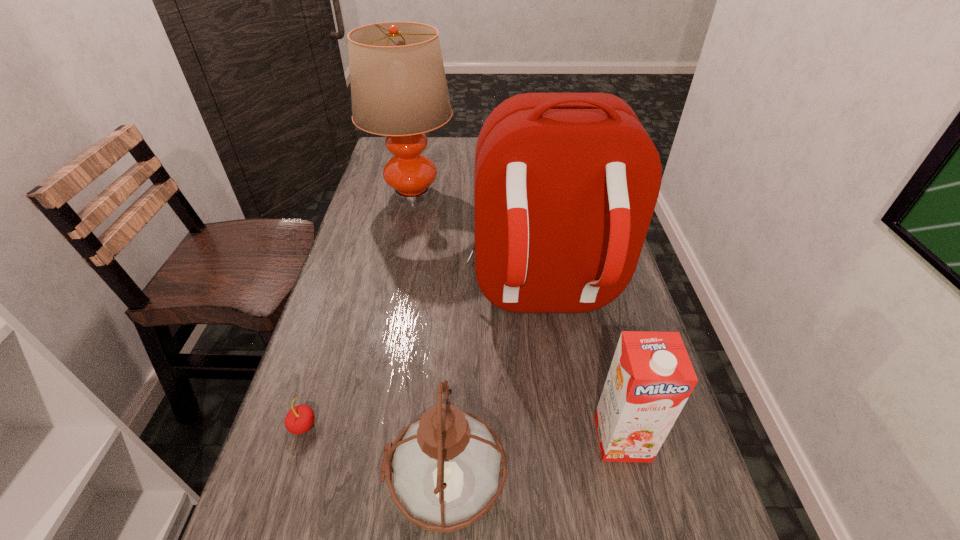
I want to click on backpack that is at the right edge, so click(x=566, y=184).

The image size is (960, 540). What are the coordinates of `carton that is at the right edge` in the screenshot? It's located at (651, 377).

In the image, there is a desktop. Find the location of `vacant area at the far edge`. vacant area at the far edge is located at coordinates (448, 158).

In the image, there is a desktop. Where is `vacant space at the left edge`? vacant space at the left edge is located at coordinates (301, 524).

At what (x,y) coordinates should I click in order to perform the action: click on free region at the right edge of the desktop. Please return your answer as a coordinate pair (x, y). The height and width of the screenshot is (540, 960). Looking at the image, I should click on (692, 489).

This screenshot has width=960, height=540. I want to click on free spot between the cherry and the farthest object, so click(358, 310).

Locate an element on the screen. free space between the backpack and the carton is located at coordinates click(x=582, y=367).

Image resolution: width=960 pixels, height=540 pixels. I want to click on free space between the carton and the lamp, so click(x=517, y=316).

Identify the location of object that is the closest to the farthest object. The height and width of the screenshot is (540, 960). (566, 184).

Identify the location of the third closest object to the farthest object. The height and width of the screenshot is (540, 960). [446, 466].